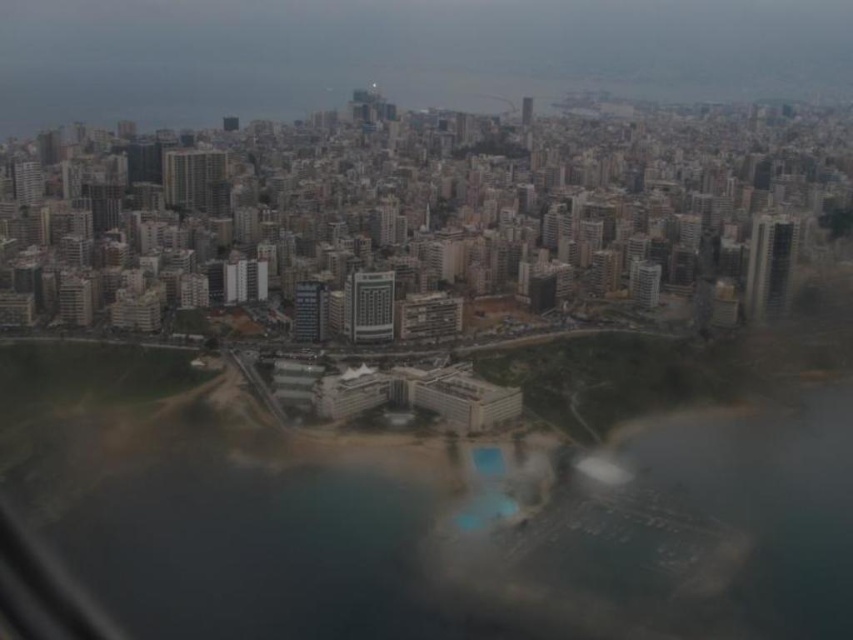
You are a drone operator flying over the city. Your task is to deliver a package to the matte glass building at center. However, you must avoid flying over the clear blue water at center. Based on the scene, can you safely navigate around the water to reach the building?

The clear blue water at center is to the right of the matte glass building at center. Therefore, you can safely navigate by approaching from the left side of the matte glass building at center to avoid the water.